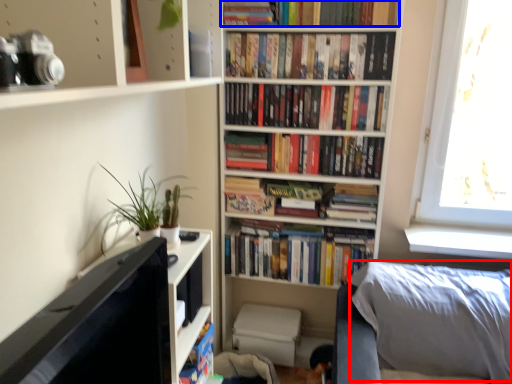
Question: Which object appears closest to the camera in this image, pillow (highlighted by a red box) or book (highlighted by a blue box)?

Choices:
 (A) pillow
 (B) book

Answer: (A)